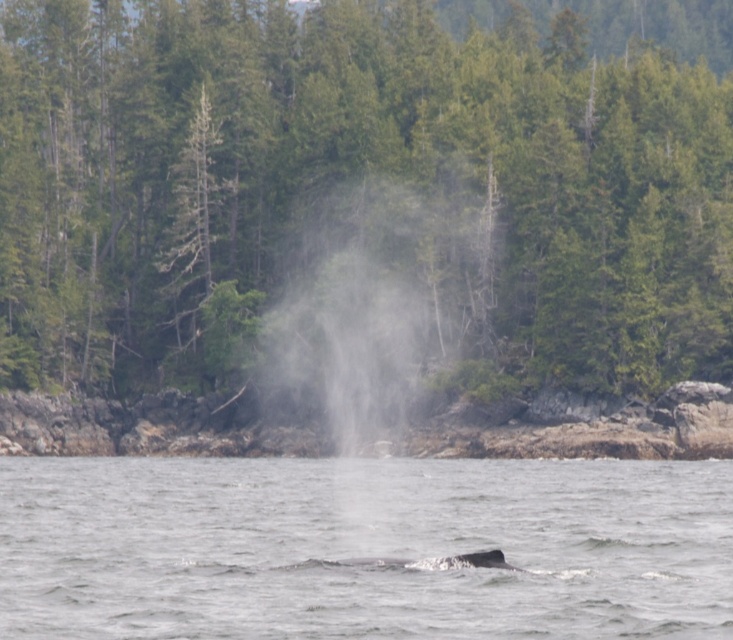
Is green leafy tree at center above gray water at center?

Yes, green leafy tree at center is above gray water at center.

This screenshot has height=640, width=733. I want to click on green leafy tree at center, so click(356, 188).

Where is `green leafy tree at center`? This screenshot has width=733, height=640. green leafy tree at center is located at coordinates (356, 188).

Between green leafy tree at center and gray spotted whale at lower center, which one appears on the right side from the viewer's perspective?

green leafy tree at center

What do you see at coordinates (356, 188) in the screenshot? This screenshot has width=733, height=640. I see `green leafy tree at center` at bounding box center [356, 188].

You are a GUI agent. You are given a task and a screenshot of the screen. Output one action in this format:
    pyautogui.click(x=<x>, y=<y>)
    Task: Click on the green leafy tree at center
    
    Given the screenshot: What is the action you would take?
    pyautogui.click(x=356, y=188)

Can you confirm if gray water at center is bigger than gray spotted whale at lower center?

Yes.

Who is shorter, gray water at center or gray spotted whale at lower center?

Standing shorter between the two is gray spotted whale at lower center.

Is point (228, 628) positioned behind point (402, 561)?

No, (228, 628) is closer to viewer.

Identify the location of gray water at center. This screenshot has width=733, height=640. (361, 547).